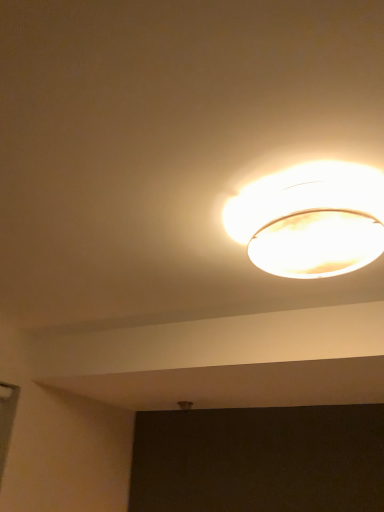
Locate an element on the screen. The height and width of the screenshot is (512, 384). white glossy lampshade at upper right is located at coordinates (310, 219).

What do you see at coordinates (310, 219) in the screenshot? The width and height of the screenshot is (384, 512). I see `white glossy lampshade at upper right` at bounding box center [310, 219].

Locate an element on the screen. The height and width of the screenshot is (512, 384). white glossy lampshade at upper right is located at coordinates (310, 219).